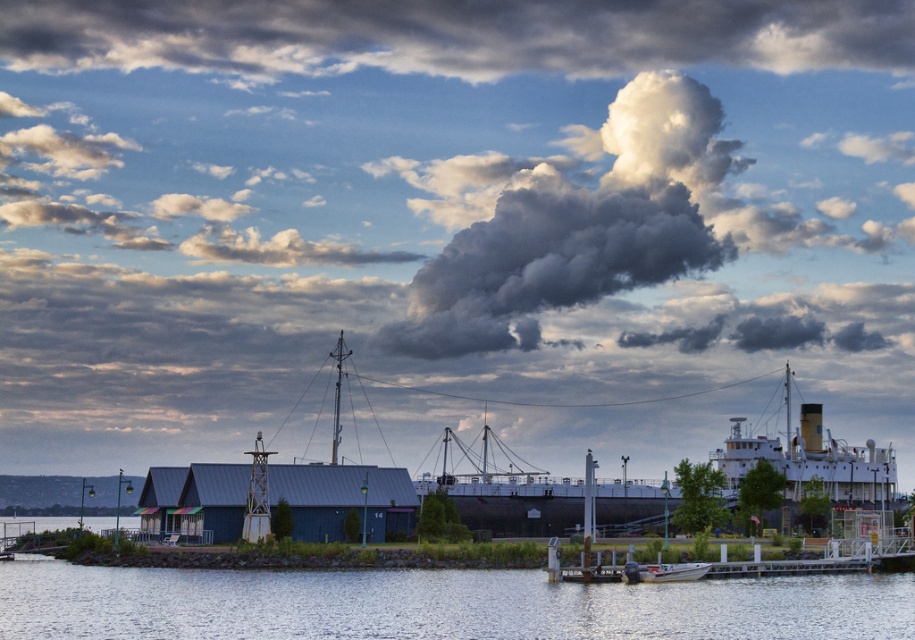
In the scene shown: Which is more to the right, white fluffy cloud at upper center or white glossy ship at upper right?

white glossy ship at upper right is more to the right.

Can you confirm if white fluffy cloud at upper center is positioned above white glossy ship at upper right?

Yes.

Locate an element on the screen. This screenshot has height=640, width=915. white fluffy cloud at upper center is located at coordinates (569, 225).

Measure the distance between point (789, 372) and camera.

Point (789, 372) and camera are 535.84 feet apart.

Who is positioned more to the left, white glossy ship at upper right or white glossy boat at lower center?

From the viewer's perspective, white glossy boat at lower center appears more on the left side.

Between point (755, 444) and point (695, 579), which one is positioned in front?

Point (695, 579) is in front.

Locate an element on the screen. white glossy ship at upper right is located at coordinates (811, 460).

Which is below, clear water at lower center or white glossy boat at lower center?

Positioned lower is clear water at lower center.

Is point (18, 600) closer to viewer compared to point (682, 570)?

Yes, it is.

What are the coordinates of `clear water at lower center` in the screenshot? It's located at (436, 604).

This screenshot has width=915, height=640. In order to click on clear water at lower center in this screenshot , I will do `click(436, 604)`.